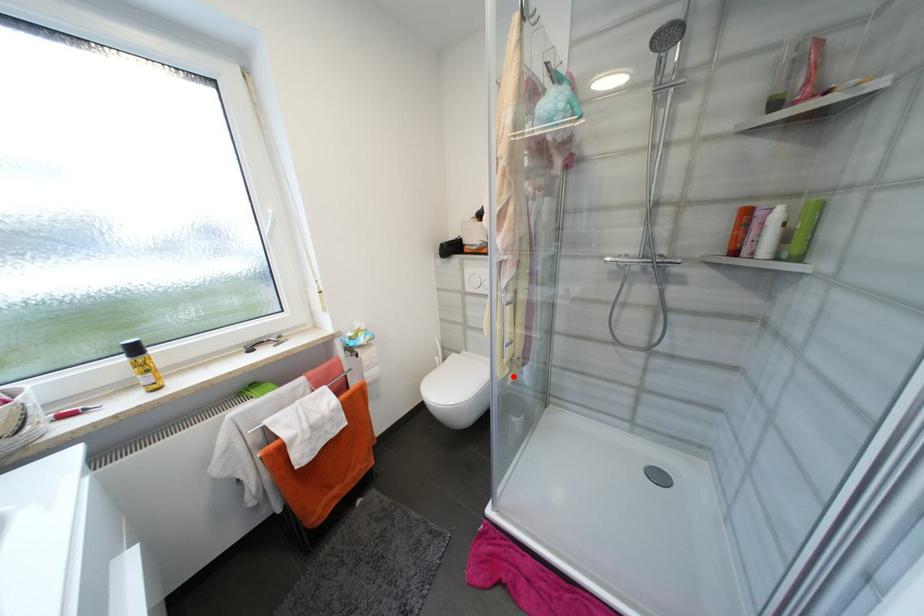
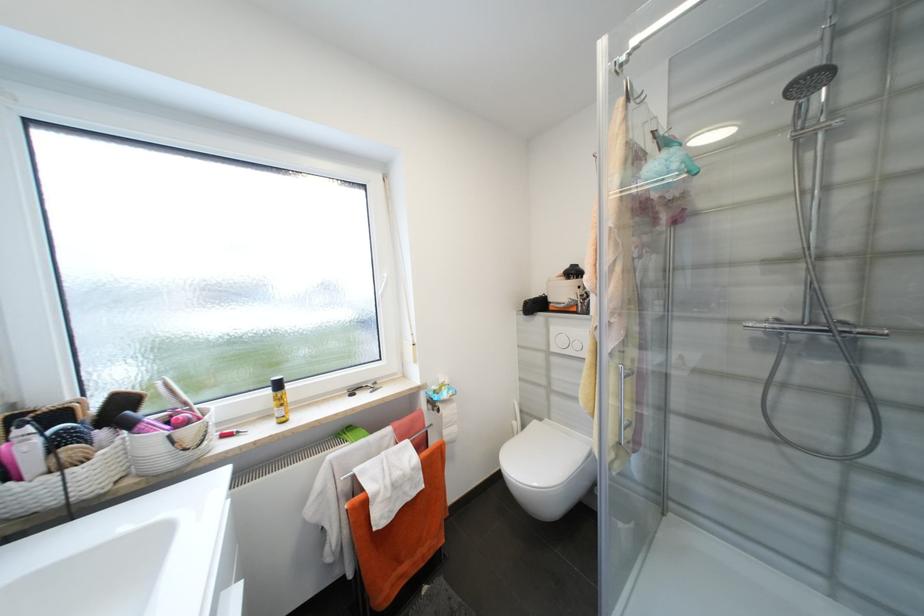
Question: I am providing you with two images of the same scene from different viewpoints. In image1, a red point is highlighted. Considering the same 3D point in image2, which of the following is correct?

Choices:
 (A) It is closer
 (B) It is farther

Answer: (A)